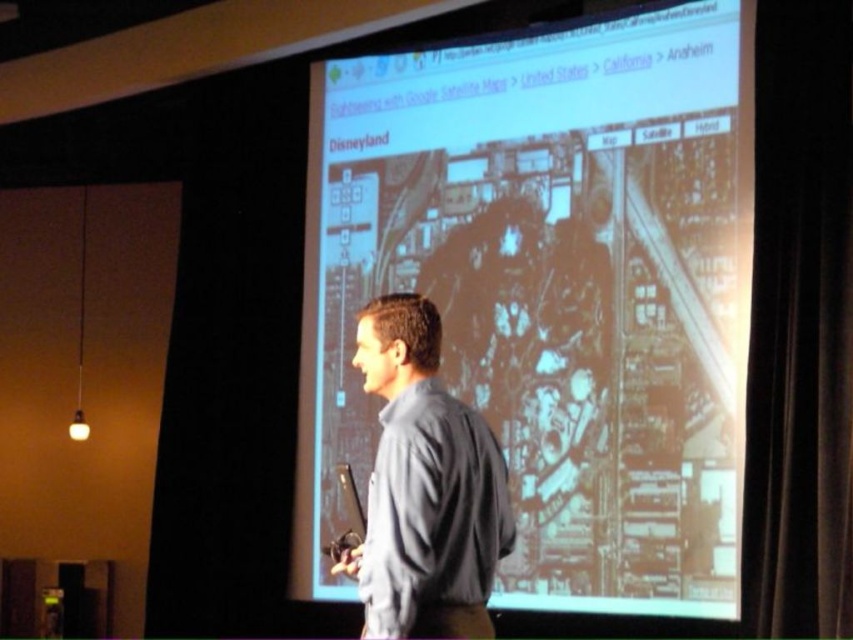
Question: Does black velvet curtain at right appear under gray fabric shirt at center?

Choices:
 (A) yes
 (B) no

Answer: (B)

Question: Can you confirm if black velvet curtain at right is wider than gray fabric shirt at center?

Choices:
 (A) no
 (B) yes

Answer: (A)

Question: Which is farther from the matte black projector screen at center?

Choices:
 (A) gray fabric shirt at center
 (B) black velvet curtain at right

Answer: (A)

Question: Estimate the real-world distances between objects in this image. Which object is farther from the gray fabric shirt at center?

Choices:
 (A) black velvet curtain at right
 (B) matte black projector screen at center

Answer: (B)

Question: Among these points, which one is farthest from the camera?

Choices:
 (A) (782, 358)
 (B) (720, 168)

Answer: (B)

Question: Can you confirm if matte black projector screen at center is thinner than black velvet curtain at right?

Choices:
 (A) yes
 (B) no

Answer: (B)